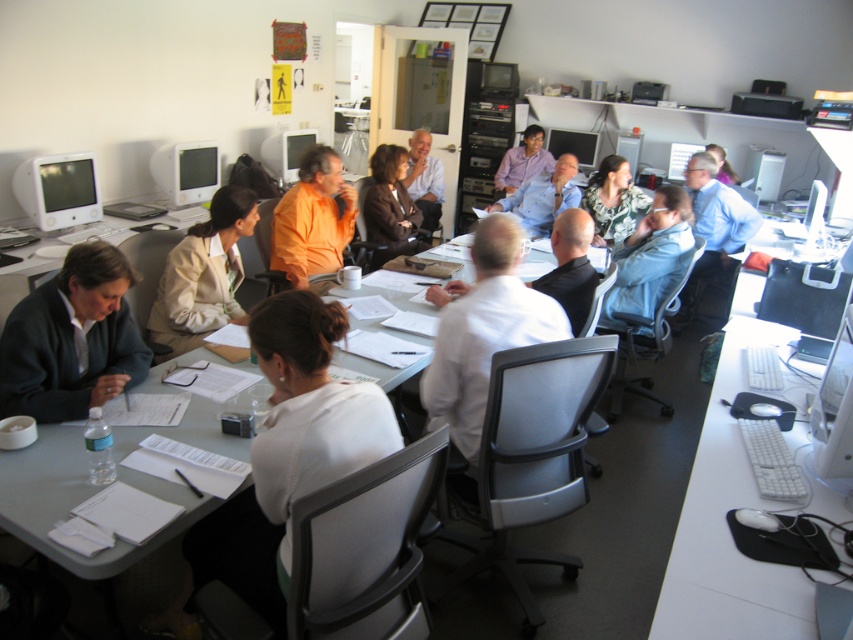
Question: Which point is closer to the camera taking this photo?

Choices:
 (A) (548, 289)
 (B) (428, 136)

Answer: (A)

Question: Is matte black monitor at left further to the viewer compared to matte black monitor at center?

Choices:
 (A) no
 (B) yes

Answer: (A)

Question: Can you confirm if white plastic table at right is thinner than matte purple shirt at center?

Choices:
 (A) no
 (B) yes

Answer: (A)

Question: Considering the real-world distances, which object is closest to the blue shirt at center?

Choices:
 (A) matte brown jacket at center
 (B) matte purple shirt at center
 (C) matte black sweater at lower left

Answer: (A)

Question: Is white paper at center smaller than matte purple shirt at center?

Choices:
 (A) no
 (B) yes

Answer: (A)

Question: Estimate the real-world distances between objects in this image. Which object is farther from the matte purple shirt at center?

Choices:
 (A) beige fabric jacket at center
 (B) blue shirt at center
 (C) matte black monitor at upper center

Answer: (A)